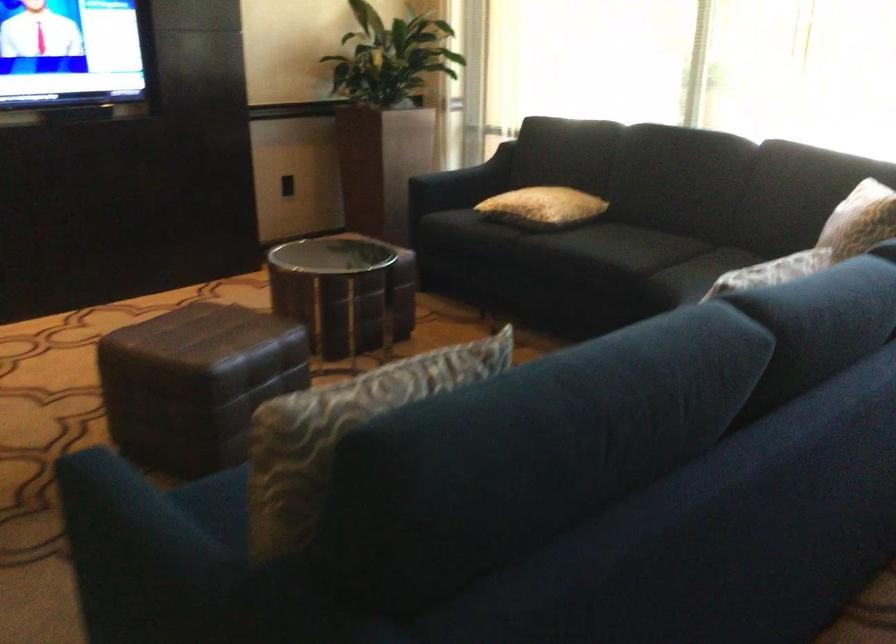
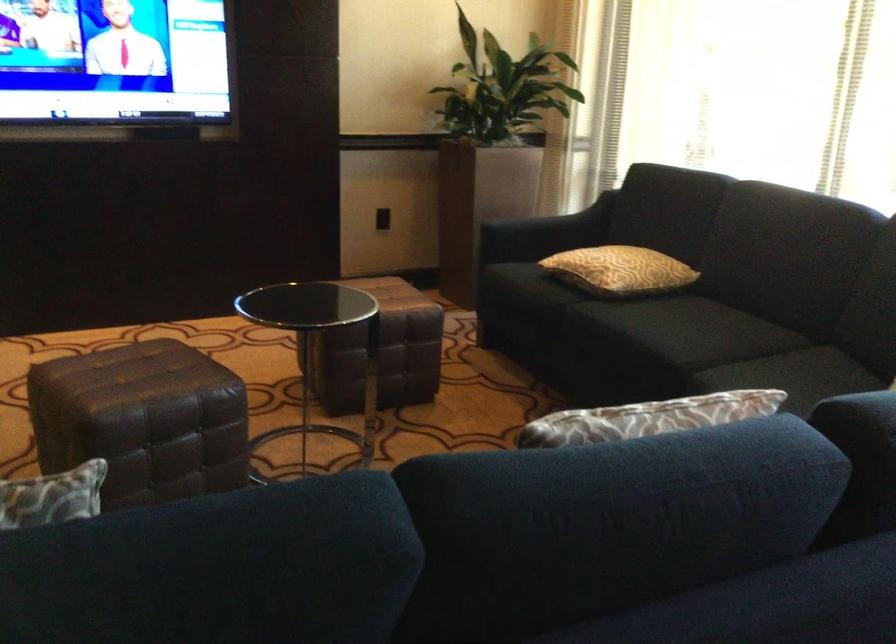
Question: The camera is either moving clockwise (left) or counter-clockwise (right) around the object. The first image is from the beginning of the video and the second image is from the end. Is the camera moving left or right when shooting the video?

Choices:
 (A) Left
 (B) Right

Answer: (B)